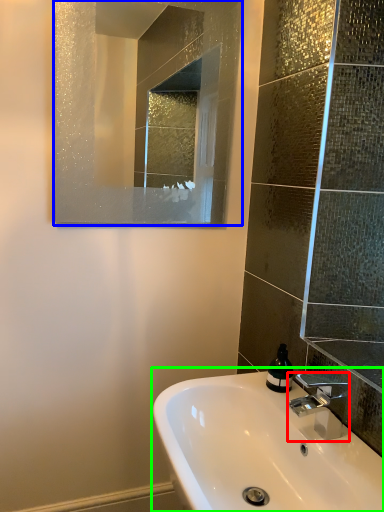
Question: Based on their relative distances, which object is farther from tap (highlighted by a red box)? Choose from mirror (highlighted by a blue box) and sink (highlighted by a green box).

Choices:
 (A) mirror
 (B) sink

Answer: (A)